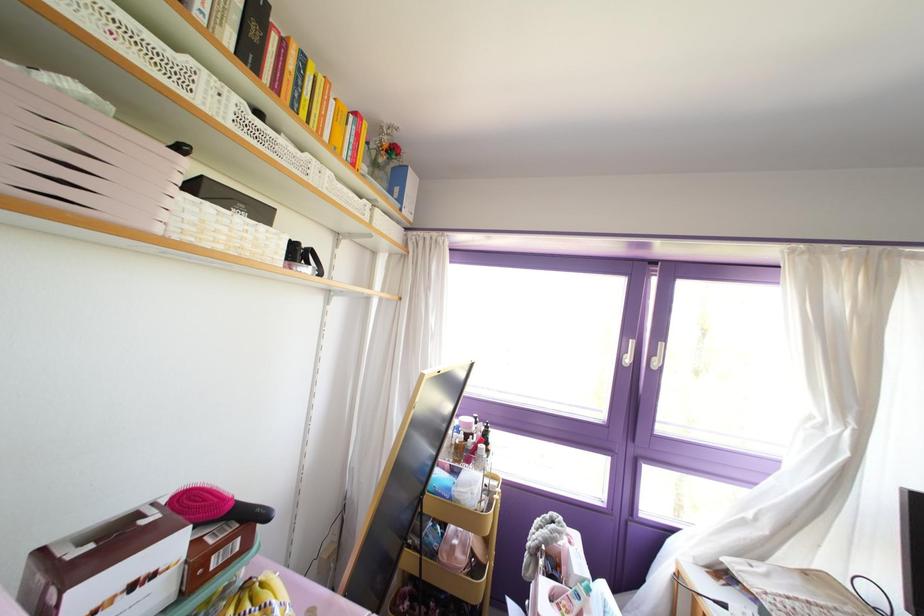
You are a GUI agent. You are given a task and a screenshot of the screen. Output one action in this format:
    pyautogui.click(x=<x>, y=<y>)
    Task: Click on the glass vase
    This screenshot has height=616, width=924.
    Given the screenshot: What is the action you would take?
    pyautogui.click(x=383, y=153)